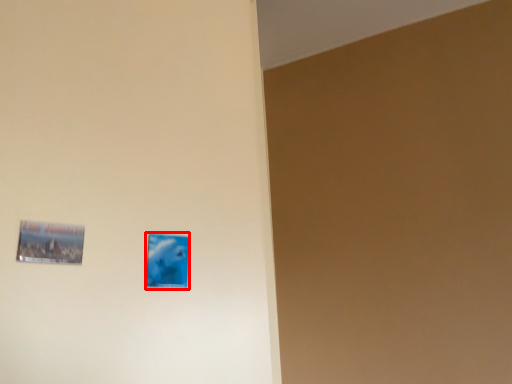
Question: Where is picture frame (annotated by the red box) located in relation to picture frame in the image?

Choices:
 (A) left
 (B) right

Answer: (B)